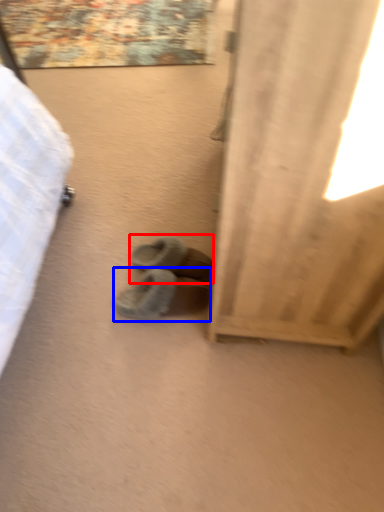
Question: Which of the following is the closest to the observer, footwear (highlighted by a red box) or footwear (highlighted by a blue box)?

Choices:
 (A) footwear
 (B) footwear

Answer: (B)